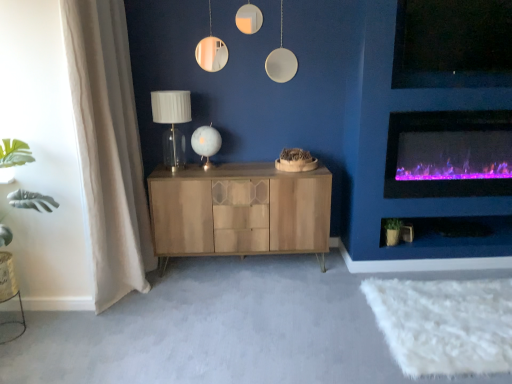
Question: Does green matte plant at lower right appear on the right side of purple electric fireplace at right?

Choices:
 (A) yes
 (B) no

Answer: (B)

Question: Is the position of green matte plant at lower right less distant than that of purple electric fireplace at right?

Choices:
 (A) yes
 (B) no

Answer: (B)

Question: Is green matte plant at lower right not near purple electric fireplace at right?

Choices:
 (A) no
 (B) yes

Answer: (A)

Question: From a real-world perspective, does green matte plant at lower right stand above purple electric fireplace at right?

Choices:
 (A) yes
 (B) no

Answer: (B)

Question: From a real-world perspective, does green matte plant at lower right sit lower than purple electric fireplace at right?

Choices:
 (A) yes
 (B) no

Answer: (A)

Question: From the image's perspective, is white glass table lamp at center, which is the 2th table lamp in left-to-right order, positioned above or below beige fabric curtain at left?

Choices:
 (A) above
 (B) below

Answer: (A)

Question: Considering the positions of point (202, 137) and point (115, 34), is point (202, 137) closer or farther from the camera than point (115, 34)?

Choices:
 (A) closer
 (B) farther

Answer: (B)

Question: Do you think white glass table lamp at center, positioned as the 1th table lamp in right-to-left order, is within beige fabric curtain at left, or outside of it?

Choices:
 (A) inside
 (B) outside

Answer: (B)

Question: Is white glass table lamp at center, positioned as the 1th table lamp in right-to-left order, to the left or to the right of beige fabric curtain at left in the image?

Choices:
 (A) right
 (B) left

Answer: (A)

Question: Is matte white glass table lamp at center, placed as the 2th table lamp when sorted from right to left, wider or thinner than white glass table lamp at center, which is the 2th table lamp in left-to-right order?

Choices:
 (A) thin
 (B) wide

Answer: (B)

Question: Is matte white glass table lamp at center, placed as the 2th table lamp when sorted from right to left, situated inside white glass table lamp at center, positioned as the 1th table lamp in right-to-left order, or outside?

Choices:
 (A) outside
 (B) inside

Answer: (A)

Question: Looking at the image, does matte white glass table lamp at center, placed as the 2th table lamp when sorted from right to left, seem bigger or smaller compared to white glass table lamp at center, positioned as the 1th table lamp in right-to-left order?

Choices:
 (A) big
 (B) small

Answer: (A)

Question: Considering the relative positions of matte white glass table lamp at center, marked as the 1th table lamp in a left-to-right arrangement, and white glass table lamp at center, which is the 2th table lamp in left-to-right order, in the image provided, is matte white glass table lamp at center, marked as the 1th table lamp in a left-to-right arrangement, to the left or to the right of white glass table lamp at center, which is the 2th table lamp in left-to-right order,?

Choices:
 (A) right
 (B) left

Answer: (B)

Question: Is point (404, 183) positioned closer to the camera than point (209, 140)?

Choices:
 (A) farther
 (B) closer

Answer: (A)

Question: From a real-world perspective, is purple electric fireplace at right physically located above or below white glass table lamp at center, positioned as the 1th table lamp in right-to-left order?

Choices:
 (A) below
 (B) above

Answer: (A)